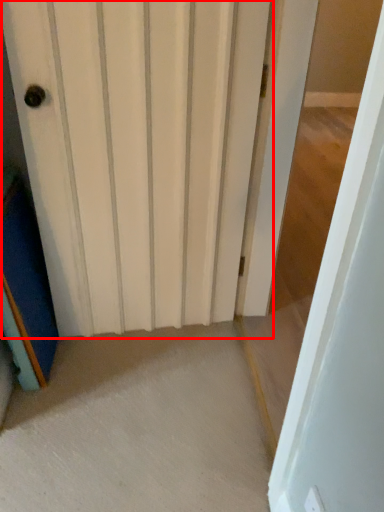
Question: From the image's perspective, where is door (annotated by the red box) located relative to door?

Choices:
 (A) above
 (B) below

Answer: (A)